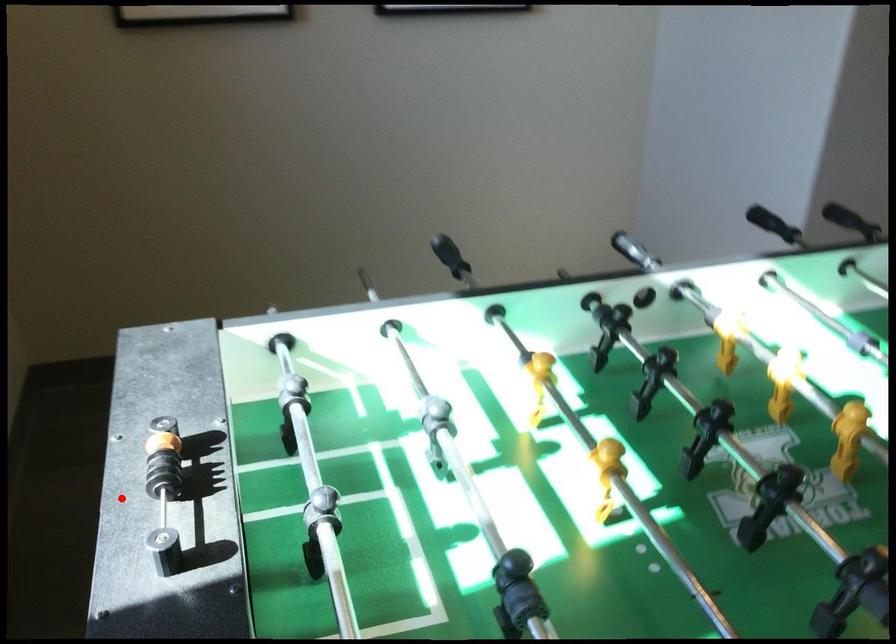
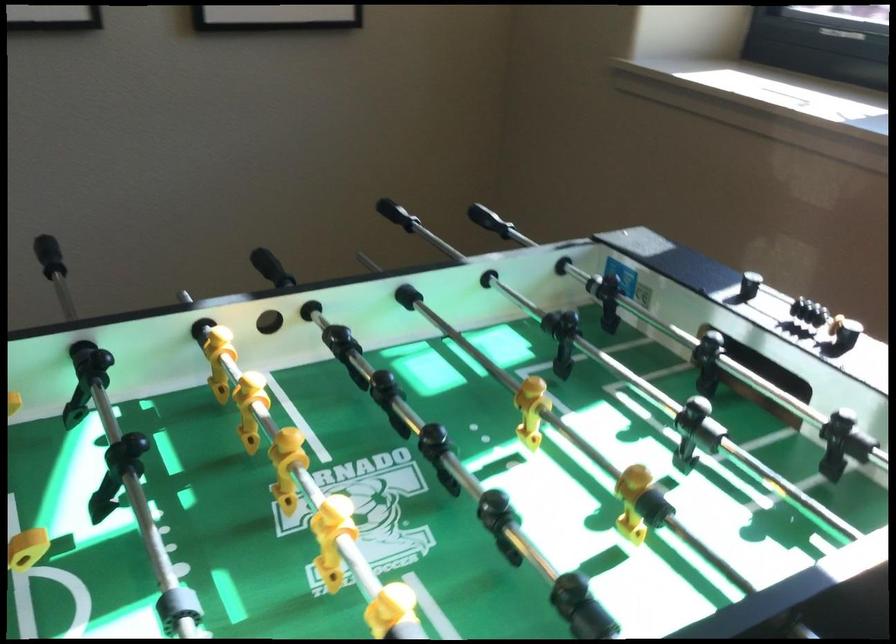
Locate, in the second image, the point that corresponds to the highlighted location in the first image.

(798, 307)